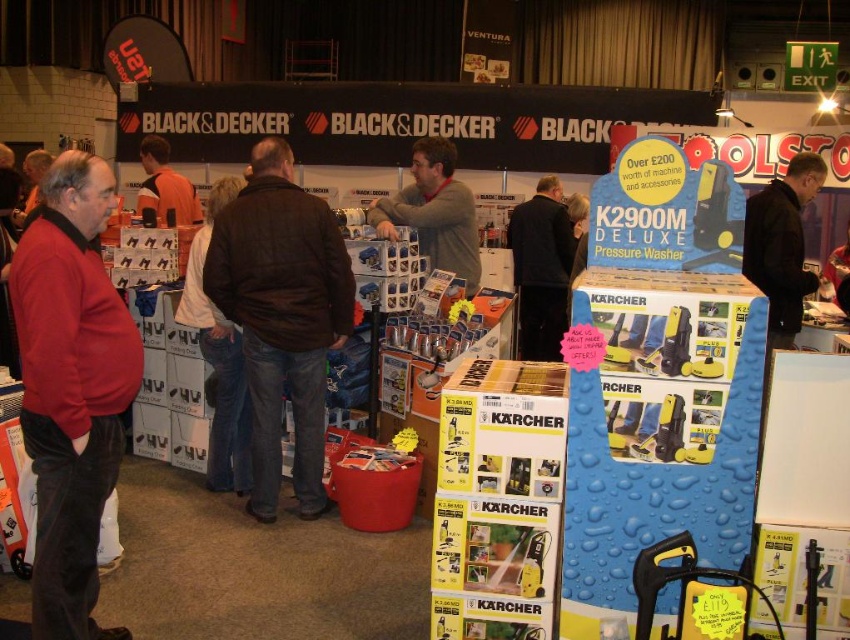
Does gray fabric jacket at center appear on the left side of orange fabric shirt at center?

No, gray fabric jacket at center is not to the left of orange fabric shirt at center.

This screenshot has height=640, width=850. What do you see at coordinates (434, 211) in the screenshot?
I see `gray fabric jacket at center` at bounding box center [434, 211].

Measure the distance between gray fabric jacket at center and camera.

They are 3.94 meters apart.

Locate an element on the screen. This screenshot has width=850, height=640. gray fabric jacket at center is located at coordinates (434, 211).

Looking at this image, who is positioned more to the left, dark gray jacket at center or gray fabric jacket at center?

From the viewer's perspective, gray fabric jacket at center appears more on the left side.

Does dark gray jacket at center come behind gray fabric jacket at center?

Yes, it is behind gray fabric jacket at center.

Who is more forward, (522, 332) or (411, 218)?

Point (411, 218)

Identify the location of dark gray jacket at center. (541, 269).

Can you confirm if black matte jacket at upper right is bigger than gray fabric jacket at center?

Actually, black matte jacket at upper right might be smaller than gray fabric jacket at center.

Is black matte jacket at upper right to the right of gray fabric jacket at center from the viewer's perspective?

Correct, you'll find black matte jacket at upper right to the right of gray fabric jacket at center.

Identify the location of black matte jacket at upper right. (782, 244).